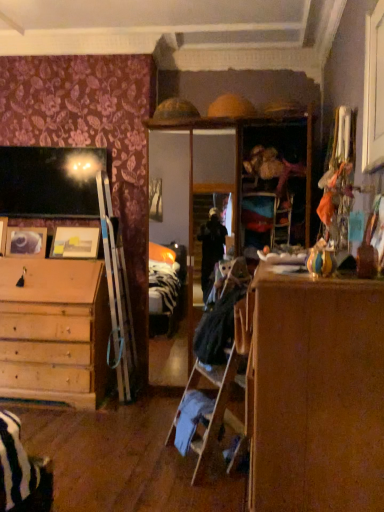
Question: From a real-world perspective, is wooden photo frame at left, which appears as the 1th picture frame when viewed from the left, above or below brown wood dresser at center?

Choices:
 (A) above
 (B) below

Answer: (A)

Question: Relative to brown wood dresser at center, is wooden photo frame at left, which appears as the 1th picture frame when viewed from the left, in front or behind?

Choices:
 (A) behind
 (B) front

Answer: (A)

Question: Which object is the farthest from the wooden photo frame at left, which appears as the 1th picture frame when viewed from the left?

Choices:
 (A) brown wood dresser at center
 (B) matte wooden picture frame at left, which appears as the 1th picture frame when viewed from the right
 (C) black fabric laundry at center

Answer: (A)

Question: Which is nearer to the matte wooden picture frame at left, the 2th picture frame when ordered from left to right?

Choices:
 (A) brown wood dresser at center
 (B) black fabric laundry at center
 (C) wooden photo frame at left, marked as the second picture frame in a right-to-left arrangement

Answer: (C)